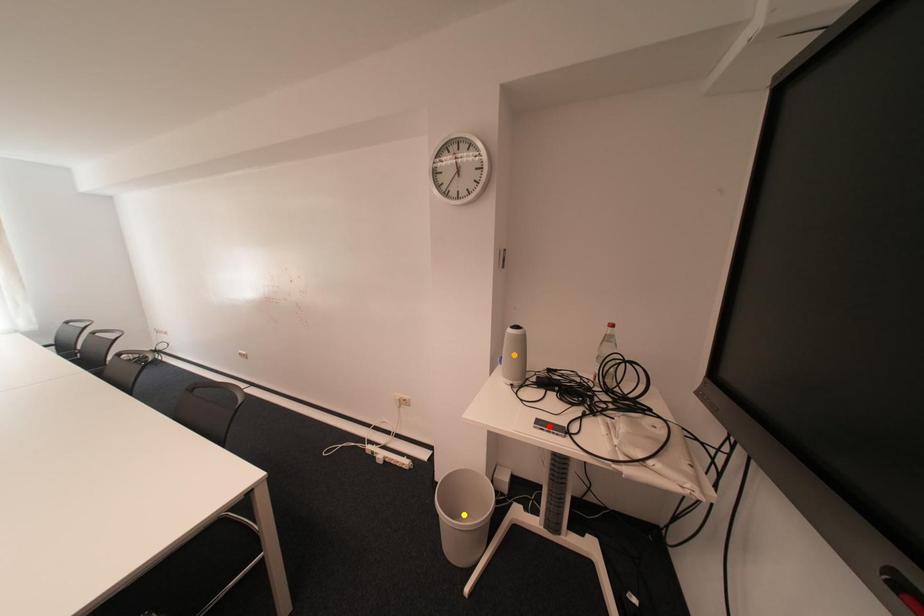
Based on the photo, order these from nearest to farthest:
yellow point
red point
orange point

red point → orange point → yellow point